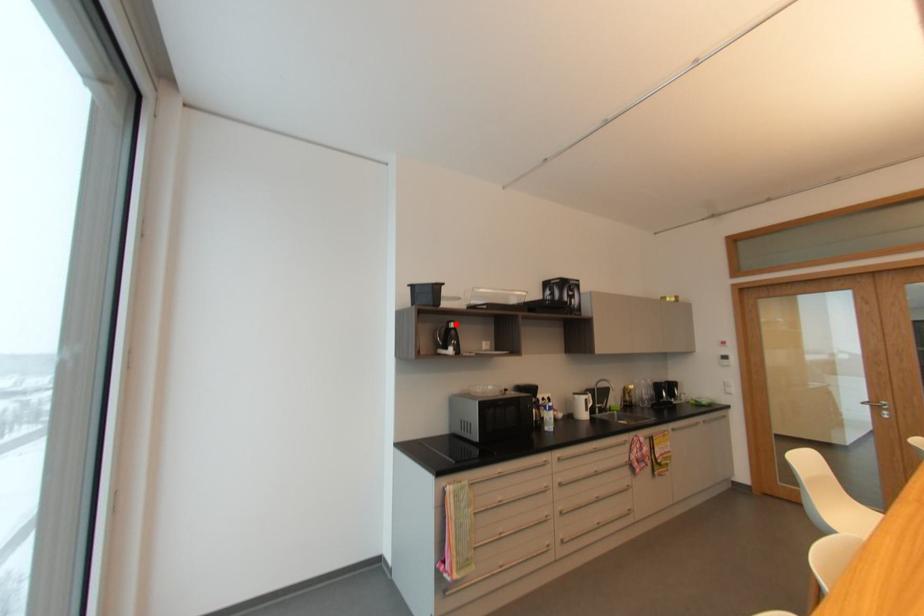
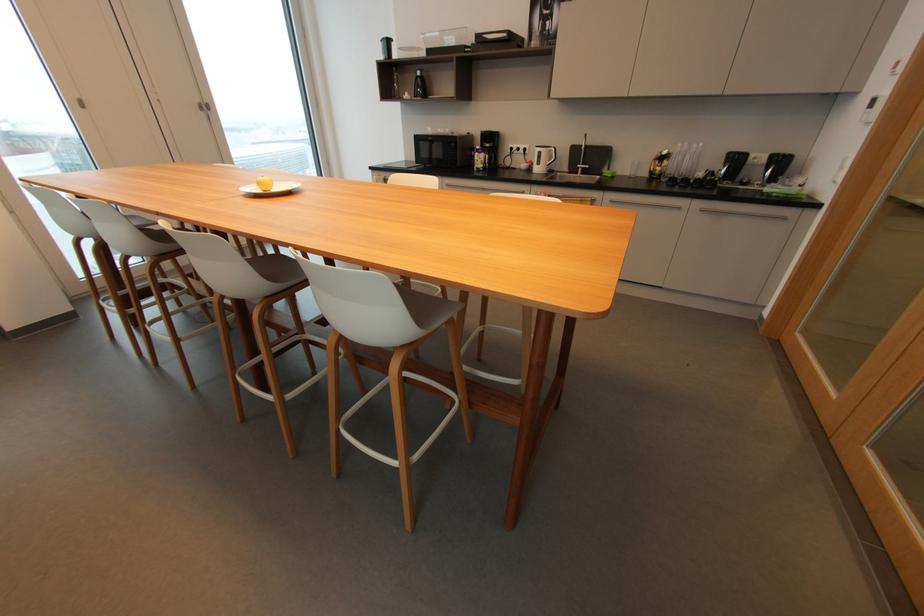
Find the pixel in the second image that matches the highlighted location in the first image.

(421, 74)